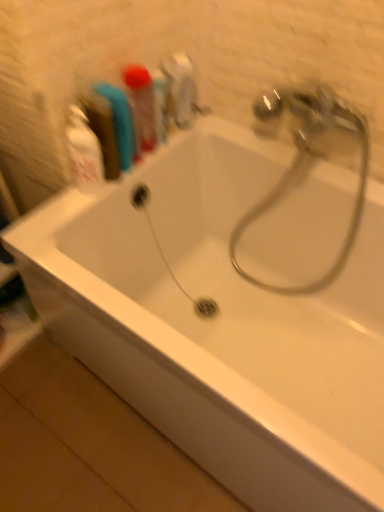
Question: Can translucent plastic toothbrush at upper left, acting as the first toiletry starting from the right, be found inside polished chrome tap at upper right?

Choices:
 (A) yes
 (B) no

Answer: (B)

Question: From a real-world perspective, does polished chrome tap at upper right sit lower than translucent plastic toothbrush at upper left, acting as the first toiletry starting from the right?

Choices:
 (A) yes
 (B) no

Answer: (A)

Question: Considering the relative positions of polished chrome tap at upper right and translucent plastic toothbrush at upper left, which is the second toiletry in left-to-right order, in the image provided, is polished chrome tap at upper right to the right of translucent plastic toothbrush at upper left, which is the second toiletry in left-to-right order, from the viewer's perspective?

Choices:
 (A) yes
 (B) no

Answer: (A)

Question: Does polished chrome tap at upper right appear on the left side of translucent plastic toothbrush at upper left, acting as the first toiletry starting from the right?

Choices:
 (A) no
 (B) yes

Answer: (A)

Question: Would you say polished chrome tap at upper right is a long distance from translucent plastic toothbrush at upper left, which is the second toiletry in left-to-right order?

Choices:
 (A) yes
 (B) no

Answer: (B)

Question: Do you think translucent plastic toothbrush at upper left, which is the second toiletry in left-to-right order, is within polished chrome tap at upper right, or outside of it?

Choices:
 (A) outside
 (B) inside

Answer: (A)

Question: From the image's perspective, is translucent plastic toothbrush at upper left, which is the second toiletry in left-to-right order, located above or below polished chrome tap at upper right?

Choices:
 (A) above
 (B) below

Answer: (A)

Question: In the image, is translucent plastic toothbrush at upper left, acting as the first toiletry starting from the right, positioned in front of or behind polished chrome tap at upper right?

Choices:
 (A) front
 (B) behind

Answer: (B)

Question: In terms of size, does translucent plastic toothbrush at upper left, which is the second toiletry in left-to-right order, appear bigger or smaller than polished chrome tap at upper right?

Choices:
 (A) small
 (B) big

Answer: (A)

Question: From the image's perspective, is blue rubber toothbrush at upper left, which is counted as the 2th toiletry, starting from the right, positioned above or below translucent plastic toothbrush at upper left, acting as the first toiletry starting from the right?

Choices:
 (A) below
 (B) above

Answer: (A)

Question: In terms of size, does blue rubber toothbrush at upper left, which is counted as the 2th toiletry, starting from the right, appear bigger or smaller than translucent plastic toothbrush at upper left, acting as the first toiletry starting from the right?

Choices:
 (A) small
 (B) big

Answer: (A)

Question: Considering their positions, is blue rubber toothbrush at upper left, which is the first toiletry in left-to-right order, located in front of or behind translucent plastic toothbrush at upper left, acting as the first toiletry starting from the right?

Choices:
 (A) behind
 (B) front

Answer: (B)

Question: Does point (112, 120) appear closer or farther from the camera than point (135, 76)?

Choices:
 (A) closer
 (B) farther

Answer: (A)

Question: Is blue rubber toothbrush at upper left, which is counted as the 2th toiletry, starting from the right, spatially inside polished chrome tap at upper right, or outside of it?

Choices:
 (A) outside
 (B) inside

Answer: (A)

Question: Considering their positions, is blue rubber toothbrush at upper left, which is counted as the 2th toiletry, starting from the right, located in front of or behind polished chrome tap at upper right?

Choices:
 (A) front
 (B) behind

Answer: (B)